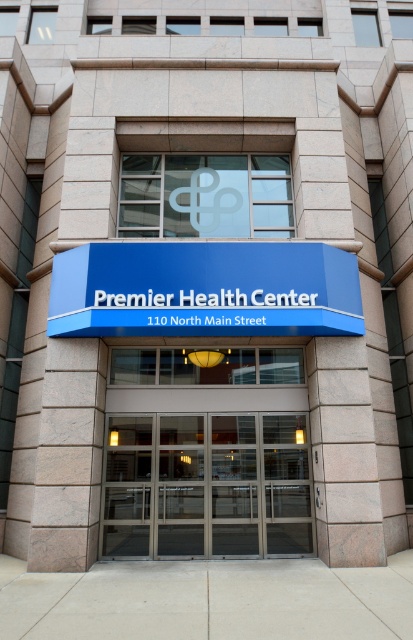
Consider the image. Who is higher up, metallic glass doors at center or blue plastic sign at center?

Positioned higher is blue plastic sign at center.

Based on the photo, is metallic glass doors at center positioned at the back of blue plastic sign at center?

That is True.

You are a GUI agent. You are given a task and a screenshot of the screen. Output one action in this format:
    pyautogui.click(x=<x>, y=<y>)
    Task: Click on the metallic glass doors at center
    
    Given the screenshot: What is the action you would take?
    pyautogui.click(x=206, y=484)